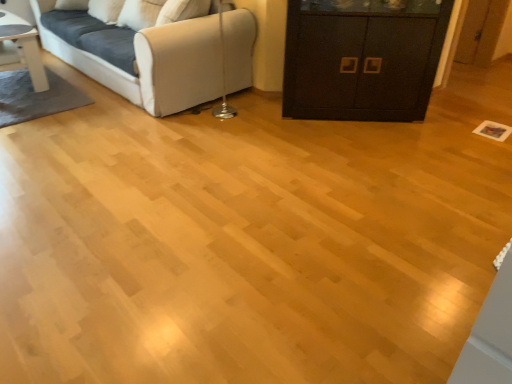
This screenshot has width=512, height=384. Describe the element at coordinates (155, 52) in the screenshot. I see `white fabric couch at upper left` at that location.

The image size is (512, 384). I want to click on black matte cabinet at center, so click(361, 64).

Locate an element on the screen. This screenshot has height=384, width=512. white glossy table at upper left is located at coordinates (24, 46).

Locate an element on the screen. white fabric couch at upper left is located at coordinates (155, 52).

Which is behind, white fabric couch at upper left or black matte cabinet at center?

white fabric couch at upper left is further from the camera.

At what (x,y) coordinates should I click in order to perform the action: click on cabinetry in front of the white fabric couch at upper left. Please return your answer as a coordinate pair (x, y). Looking at the image, I should click on (361, 64).

From a real-world perspective, is white fabric couch at upper left located higher than black matte cabinet at center?

No, from a real-world perspective, white fabric couch at upper left is not over black matte cabinet at center

How different are the orientations of white fabric couch at upper left and black matte cabinet at center in degrees?

white fabric couch at upper left and black matte cabinet at center are facing 45.6 degrees away from each other.

Considering the relative positions of white fabric couch at upper left and white glossy table at upper left in the image provided, is white fabric couch at upper left behind white glossy table at upper left?

No, it is in front of white glossy table at upper left.

Where is `studio couch that appears on the right of white glossy table at upper left`? Image resolution: width=512 pixels, height=384 pixels. studio couch that appears on the right of white glossy table at upper left is located at coordinates (155, 52).

In the scene shown: How different are the orientations of white fabric couch at upper left and white glossy table at upper left in degrees?

The facing directions of white fabric couch at upper left and white glossy table at upper left are 1.16 degrees apart.

Which object is positioned more to the left, white fabric couch at upper left or white glossy table at upper left?

From the viewer's perspective, white glossy table at upper left appears more on the left side.

Measure the distance between black matte cabinet at center and white glossy table at upper left.

The distance of black matte cabinet at center from white glossy table at upper left is 2.44 meters.

From the image's perspective, would you say black matte cabinet at center is positioned over white glossy table at upper left?

Incorrect, from the image's perspective, black matte cabinet at center is lower than white glossy table at upper left.

Can you confirm if black matte cabinet at center is bigger than white glossy table at upper left?

Indeed, black matte cabinet at center has a larger size compared to white glossy table at upper left.

From a real-world perspective, is black matte cabinet at center physically above white glossy table at upper left?

Yes, from a real-world perspective, black matte cabinet at center is above white glossy table at upper left.

Which object is more forward, white glossy table at upper left or white fabric couch at upper left?

white fabric couch at upper left is in front.

Which is closer, (30, 25) or (192, 86)?

The point (192, 86) is closer.

Is white glossy table at upper left directly adjacent to white fabric couch at upper left?

No.

From the image's perspective, is black matte cabinet at center located above or below white fabric couch at upper left?

Clearly, from the image's perspective, black matte cabinet at center is below white fabric couch at upper left.

Is black matte cabinet at center next to white fabric couch at upper left?

No, black matte cabinet at center is not next to white fabric couch at upper left.

Can you tell me how much black matte cabinet at center and white fabric couch at upper left differ in facing direction?

The angular difference between black matte cabinet at center and white fabric couch at upper left is 45.6 degrees.

Is the position of black matte cabinet at center less distant than that of white fabric couch at upper left?

Yes.

How many degrees apart are the facing directions of white glossy table at upper left and black matte cabinet at center?

white glossy table at upper left and black matte cabinet at center are facing 46.8 degrees away from each other.

Is white glossy table at upper left spatially inside black matte cabinet at center, or outside of it?

white glossy table at upper left exists outside the volume of black matte cabinet at center.

Is point (2, 16) behind point (367, 114)?

Yes.

Is white glossy table at upper left bigger or smaller than black matte cabinet at center?

white glossy table at upper left is smaller than black matte cabinet at center.

At what (x,y) coordinates should I click in order to perform the action: click on studio couch lying behind the black matte cabinet at center. Please return your answer as a coordinate pair (x, y). This screenshot has height=384, width=512. Looking at the image, I should click on (155, 52).

The height and width of the screenshot is (384, 512). Find the location of `studio couch above the white glossy table at upper left (from a real-world perspective)`. studio couch above the white glossy table at upper left (from a real-world perspective) is located at coordinates (155, 52).

Which object lies nearer to the anchor point white fabric couch at upper left, black matte cabinet at center or white glossy table at upper left?

Based on the image, white glossy table at upper left appears to be nearer to white fabric couch at upper left.

Estimate the real-world distances between objects in this image. Which object is closer to white fabric couch at upper left, white glossy table at upper left or black matte cabinet at center?

white glossy table at upper left.

Estimate the real-world distances between objects in this image. Which object is closer to white glossy table at upper left, white fabric couch at upper left or black matte cabinet at center?

white fabric couch at upper left is closer to white glossy table at upper left.

When comparing their distances from black matte cabinet at center, does white fabric couch at upper left or white glossy table at upper left seem further?

white glossy table at upper left is further to black matte cabinet at center.

Looking at the image, which one is located further to white glossy table at upper left, black matte cabinet at center or white fabric couch at upper left?

The object further to white glossy table at upper left is black matte cabinet at center.

Based on the photo, looking at the image, which one is located further to black matte cabinet at center, white glossy table at upper left or white fabric couch at upper left?

white glossy table at upper left is further to black matte cabinet at center.

Image resolution: width=512 pixels, height=384 pixels. Find the location of `studio couch located between white glossy table at upper left and black matte cabinet at center in the left-right direction`. studio couch located between white glossy table at upper left and black matte cabinet at center in the left-right direction is located at coordinates click(155, 52).